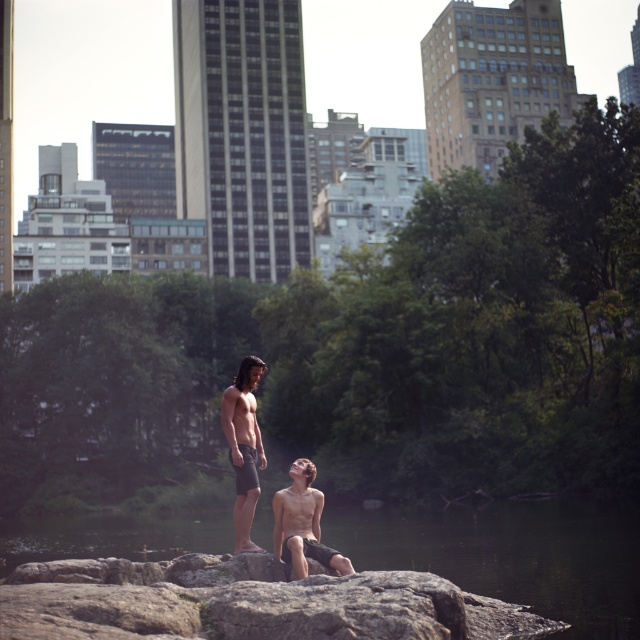
Question: Among these points, which one is nearest to the camera?

Choices:
 (A) (243, 452)
 (B) (269, 516)
 (C) (298, 493)

Answer: (C)

Question: Which of these objects is positioned closest to the dark gray stone river at center?

Choices:
 (A) matte black shorts at center
 (B) smooth skin woman at center

Answer: (B)

Question: Observing the image, what is the correct spatial positioning of dark gray stone river at center in reference to matte black shorts at center?

Choices:
 (A) below
 (B) above

Answer: (A)

Question: Can you confirm if smooth skin woman at center is bigger than matte black shorts at center?

Choices:
 (A) yes
 (B) no

Answer: (A)

Question: Which object is positioned farthest from the dark gray stone river at center?

Choices:
 (A) smooth skin woman at center
 (B) matte black shorts at center

Answer: (B)

Question: Does dark gray stone river at center appear over smooth skin woman at center?

Choices:
 (A) no
 (B) yes

Answer: (A)